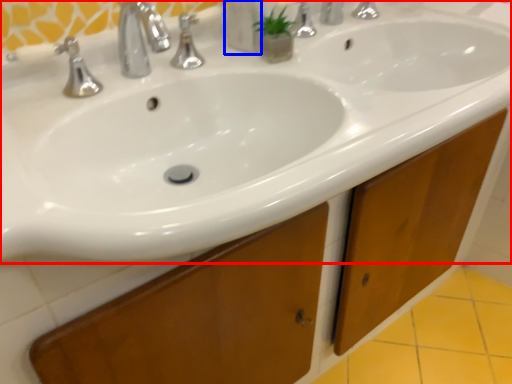
Question: Among these objects, which one is farthest to the camera, sink (highlighted by a red box) or soap dispenser (highlighted by a blue box)?

Choices:
 (A) sink
 (B) soap dispenser

Answer: (B)